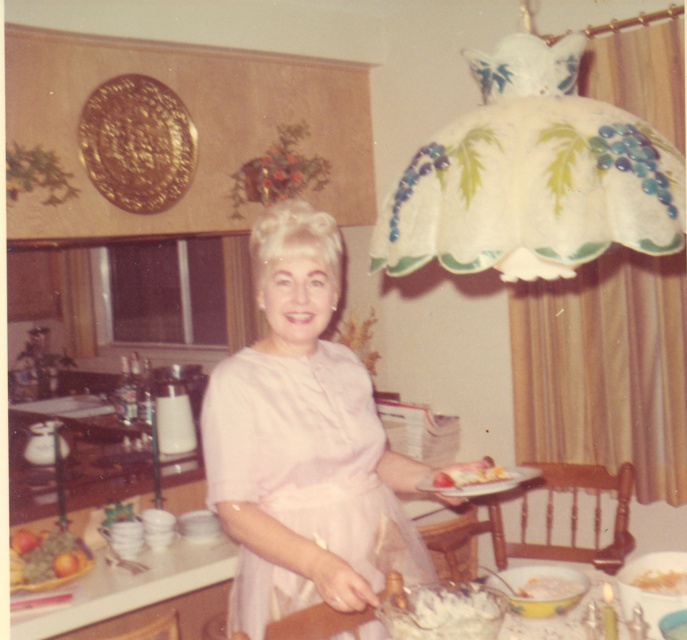
You are a chef preparing to arrange two items on a table for a display. You have the smooth white cake at lower right and the white fluffy bread at lower right. The table is only 16 inches wide. Can both items fit side by side on the table without overlapping?

The smooth white cake at lower right and white fluffy bread at lower right are 16.92 inches apart, so they cannot fit side by side on a 16 inch wide table without overlapping.

You are a guest at this vintage gathering and want to take a closer look at the white creamy dessert at lower center. However, there is a white porcelain plate at lower right in the way. Can you move the plate to access the dessert?

The white porcelain plate at lower right is in front of the white creamy dessert at lower center, so you would need to move the plate to access the dessert.